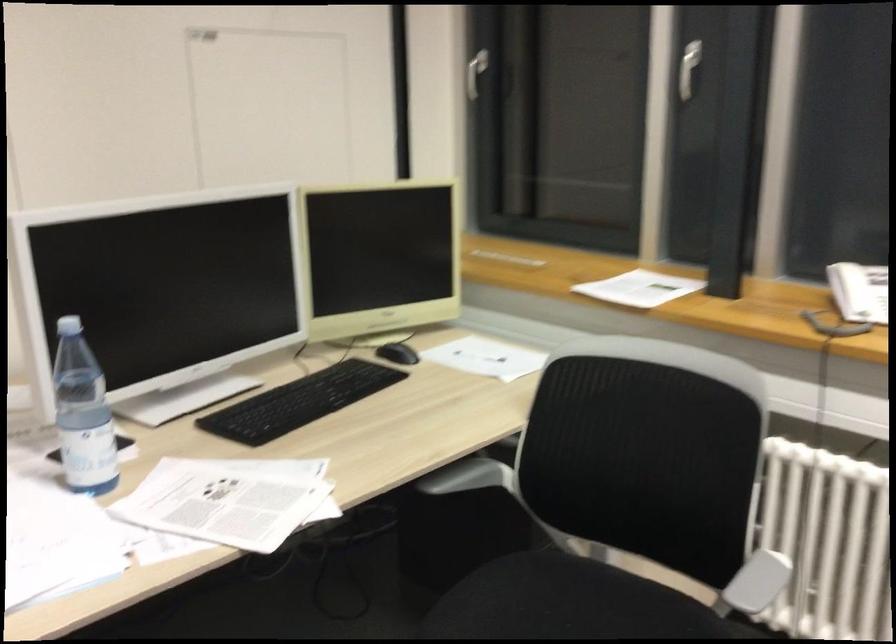
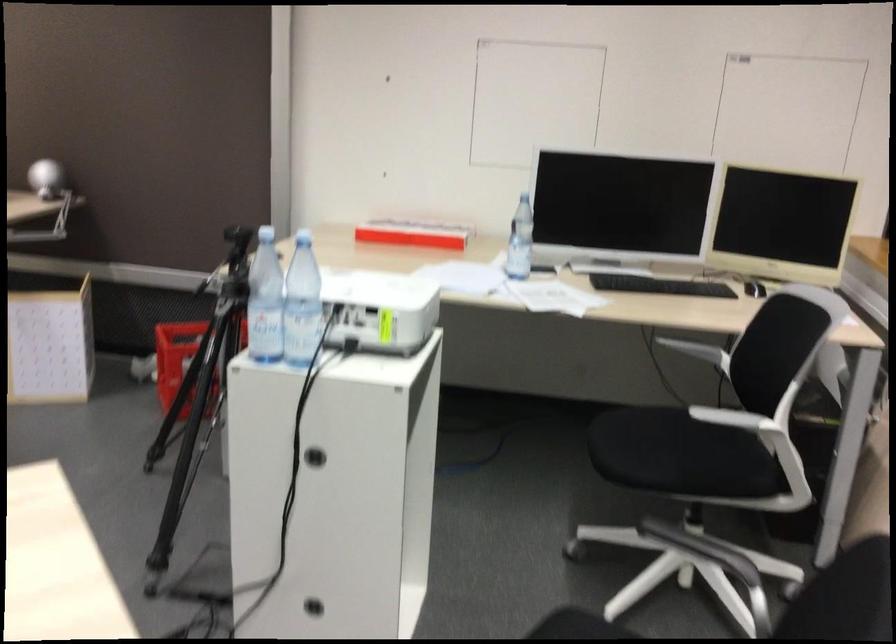
The point at (730, 567) is marked in the first image. Where is the corresponding point in the second image?

(733, 418)